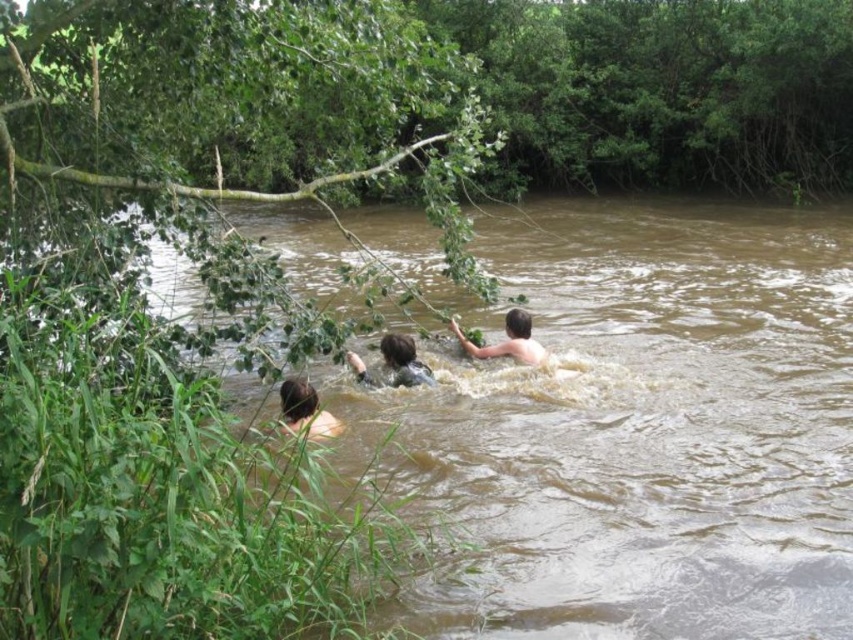
You are standing at the edge of the river and want to step into the water. The brown muddy water at center is located at point (x=637, y=429). Can you safely step into the water at that point?

The brown muddy water at center is located at point (x=637, y=429), so yes, you can safely step into the water at that point since it is part of the river where the individuals are already partially submerged and the scene depicts a natural setting with people enjoying the water.

You are a swimmer who wants to safely reach the middle of the river. You see the brown muddy water at center and the brown skin at lower left. Which object is higher and would allow you to stand without getting your head submerged?

The brown muddy water at center is taller than brown skin at lower left. Therefore, the brown muddy water at center has a greater depth, so the brown skin at lower left is higher and you can stand there without submerging your head.